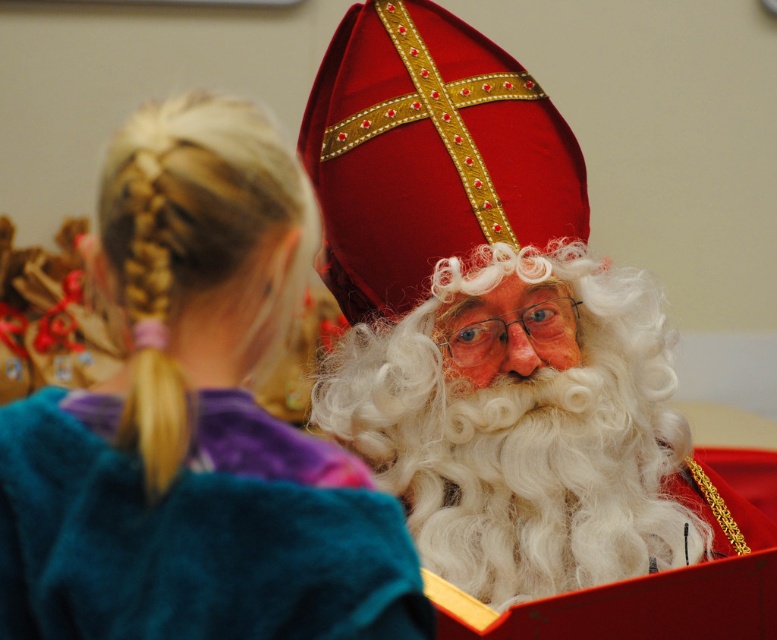
You are an event planner organizing a Christmas market and need to arrange two items for a photo shoot. You have the velvet red hat at upper center and the teal fleece sweater at upper left. Based on their positions in the image, which item should be placed to the right of the other for consistency with the original scene?

The velvet red hat at upper center should be placed to the right of the teal fleece sweater at upper left because in the original scene, the velvet red hat at upper center is positioned on the right side of the teal fleece sweater at upper left.

You are a photographer trying to capture a clear shot of both the velvet red hat at upper center and the teal fuzzy robe at upper left. Since you want both items to be visible in the frame, which object should you focus on first to ensure it doesn t get cut off?

The velvet red hat at upper center is bigger than the teal fuzzy robe at upper left, so you should focus on the velvet red hat at upper center first to ensure it fits within the frame before adjusting for the smaller teal fuzzy robe at upper left.